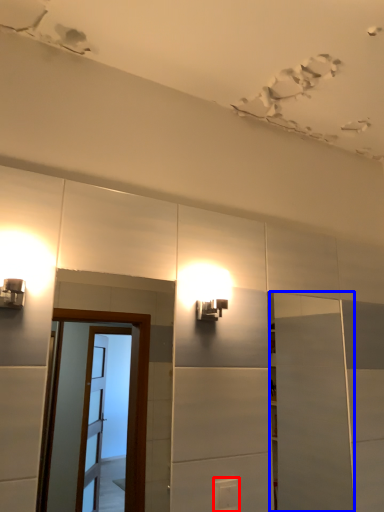
Question: Which object is further to the camera taking this photo, light switch (highlighted by a red box) or door (highlighted by a blue box)?

Choices:
 (A) light switch
 (B) door

Answer: (B)